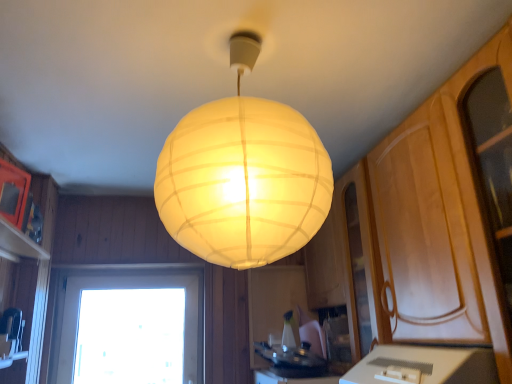
Question: From the image's perspective, does transparent glass window at lower left appear higher than white paper lampshade at center?

Choices:
 (A) no
 (B) yes

Answer: (A)

Question: From a real-world perspective, does transparent glass window at lower left stand above white paper lampshade at center?

Choices:
 (A) no
 (B) yes

Answer: (A)

Question: Is transparent glass window at lower left behind white paper lampshade at center?

Choices:
 (A) no
 (B) yes

Answer: (B)

Question: From a real-world perspective, is transparent glass window at lower left under white paper lampshade at center?

Choices:
 (A) yes
 (B) no

Answer: (A)

Question: Considering the relative sizes of transparent glass window at lower left and white paper lampshade at center in the image provided, is transparent glass window at lower left wider than white paper lampshade at center?

Choices:
 (A) no
 (B) yes

Answer: (A)

Question: Considering the relative positions of white glossy countertop at lower center and white paper lampshade at center in the image provided, is white glossy countertop at lower center to the left or to the right of white paper lampshade at center?

Choices:
 (A) right
 (B) left

Answer: (A)

Question: From a real-world perspective, is white glossy countertop at lower center physically located above or below white paper lampshade at center?

Choices:
 (A) below
 (B) above

Answer: (A)

Question: From their relative heights in the image, would you say white glossy countertop at lower center is taller or shorter than white paper lampshade at center?

Choices:
 (A) short
 (B) tall

Answer: (A)

Question: Is white glossy countertop at lower center bigger or smaller than white paper lampshade at center?

Choices:
 (A) small
 (B) big

Answer: (A)

Question: Visually, is white glossy countertop at lower center positioned to the left or to the right of transparent glass window at lower left?

Choices:
 (A) right
 (B) left

Answer: (A)

Question: Considering the positions of point (411, 349) and point (51, 344), is point (411, 349) closer or farther from the camera than point (51, 344)?

Choices:
 (A) closer
 (B) farther

Answer: (A)

Question: Is white glossy countertop at lower center bigger or smaller than transparent glass window at lower left?

Choices:
 (A) small
 (B) big

Answer: (B)

Question: Considering the positions of white glossy countertop at lower center and transparent glass window at lower left in the image, is white glossy countertop at lower center wider or thinner than transparent glass window at lower left?

Choices:
 (A) thin
 (B) wide

Answer: (B)

Question: From a real-world perspective, is white paper lampshade at center physically located above or below white glossy countertop at lower center?

Choices:
 (A) below
 (B) above

Answer: (B)

Question: Is white paper lampshade at center inside the boundaries of white glossy countertop at lower center, or outside?

Choices:
 (A) outside
 (B) inside

Answer: (A)